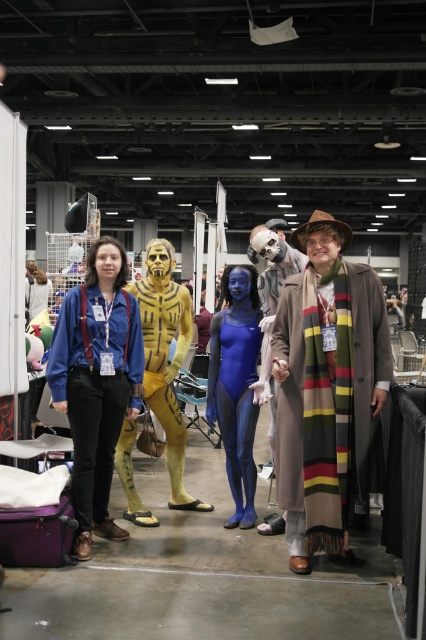
You are organizing a photo shoot and need to ensure that the striped wool scarf at right and the matte blue jeans at center are visible in the frame. Given that the camera has a fixed focal length, which object should you prioritize positioning closer to the camera to ensure visibility?

The striped wool scarf at right should be positioned closer to the camera because its width is larger than the matte blue jeans at center, making it potentially more challenging to fit within the frame if placed farther away.

You are organizing a costume parade and need to arrange the yellow matte costume at center and the blue spandex bodysuit at center in a line. If you want the larger costume to be in front, which one should you place first?

The yellow matte costume at center is bigger than the blue spandex bodysuit at center, so you should place the yellow matte costume at center first in the line to have the larger costume in front.

You are a photographer at the event and need to capture a photo of both the striped wool scarf at right and the matte blue jeans at center in the same frame. Given that your camera has a minimum focus distance of 1 meter, will you be able to take the photo without moving either object?

The distance between the striped wool scarf at right and the matte blue jeans at center is 1.11 meters, which is just over the camera minimum focus distance of 1 meter. Therefore, you can take the photo without moving either object.